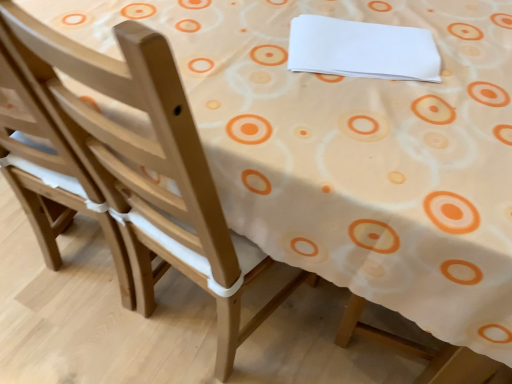
Question: Considering their positions, is light wood chair at left located in front of or behind white paper at upper center?

Choices:
 (A) front
 (B) behind

Answer: (A)

Question: Considering the positions of point (66, 140) and point (371, 72), is point (66, 140) closer or farther from the camera than point (371, 72)?

Choices:
 (A) farther
 (B) closer

Answer: (B)

Question: From the image's perspective, is light wood chair at left located above or below white paper at upper center?

Choices:
 (A) below
 (B) above

Answer: (A)

Question: Based on their sizes in the image, would you say white paper at upper center is bigger or smaller than light wood chair at left?

Choices:
 (A) big
 (B) small

Answer: (B)

Question: Which is correct: white paper at upper center is inside light wood chair at left, or outside of it?

Choices:
 (A) inside
 (B) outside

Answer: (B)

Question: From their relative heights in the image, would you say white paper at upper center is taller or shorter than light wood chair at left?

Choices:
 (A) short
 (B) tall

Answer: (A)

Question: Would you say white paper at upper center is to the left or to the right of light wood chair at left in the picture?

Choices:
 (A) left
 (B) right

Answer: (B)